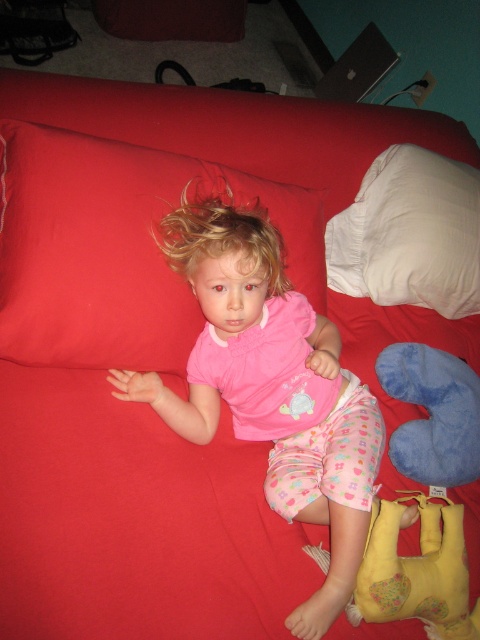
You are a photographer setting up a photo shoot in the living room. You need to ensure that the pink fabric child at center and the white soft pillow at upper right are both visible in the frame. Given their sizes, which object should you position closer to the camera to maintain their visibility?

The pink fabric child at center is much taller than the white soft pillow at upper right, so positioning the white soft pillow at upper right closer to the camera would help maintain visibility since it is smaller and might appear too small if placed farther away.